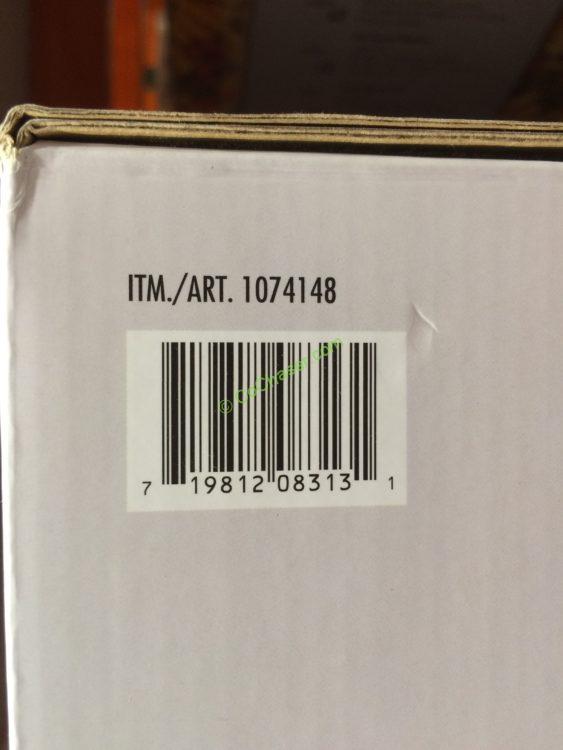
This screenshot has height=750, width=563. I want to click on white wooden box, so coord(210,616).